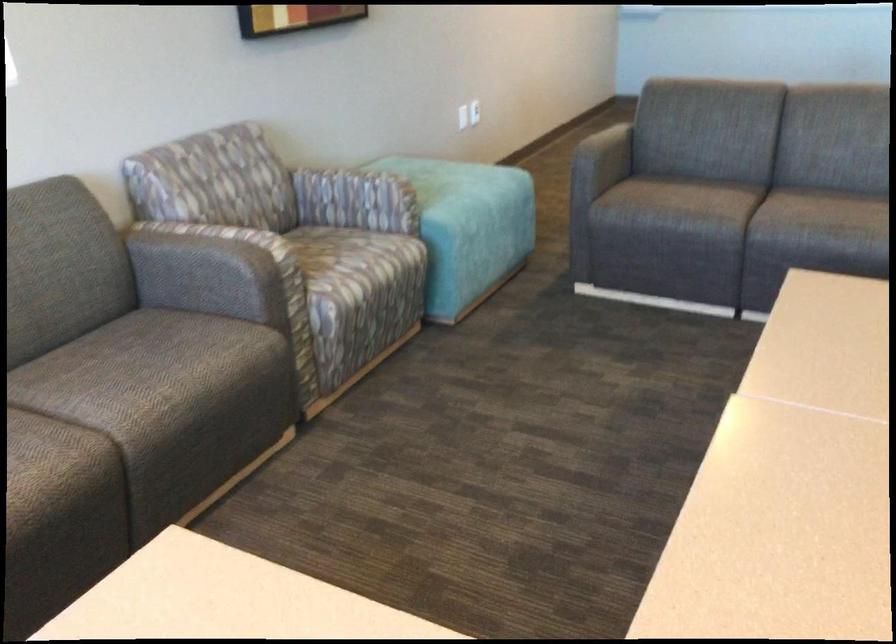
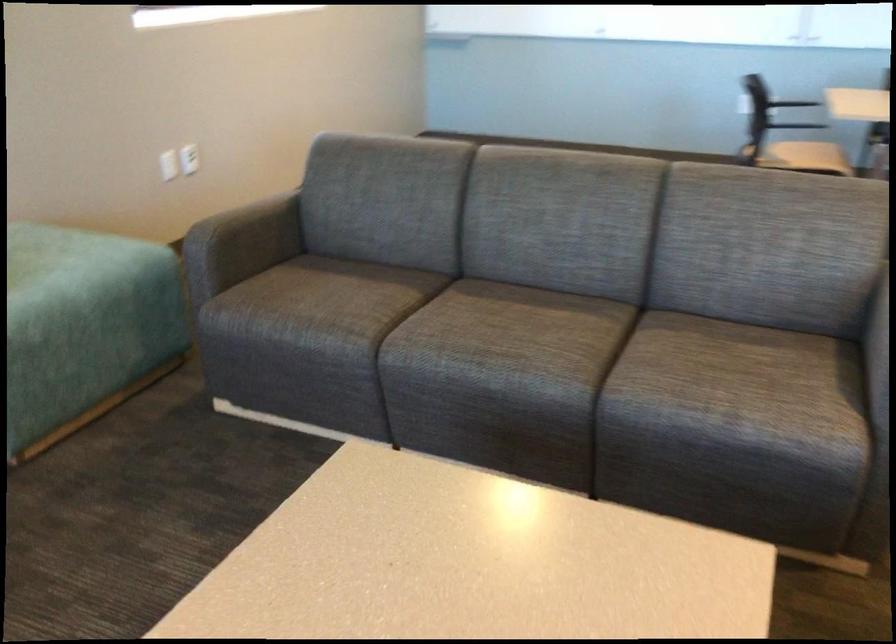
Where in the second image is the point corresponding to the point at 606,152 from the first image?

(243, 240)